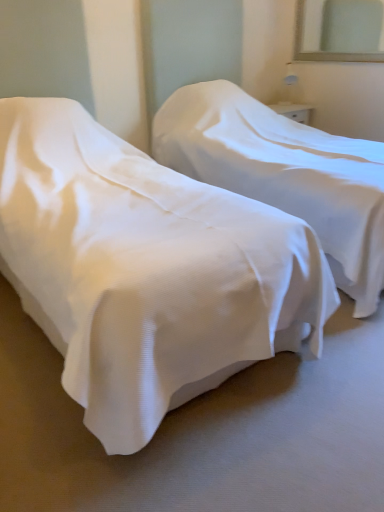
The height and width of the screenshot is (512, 384). In order to click on clear glass mirror at upper right in this screenshot , I will do `click(339, 30)`.

The image size is (384, 512). Describe the element at coordinates (284, 174) in the screenshot. I see `white fabric bed at center, marked as the 1th bed in a right-to-left arrangement` at that location.

Find the location of a particular element. This screenshot has height=512, width=384. clear glass mirror at upper right is located at coordinates (339, 30).

Is point (333, 47) in front of point (359, 231)?

No, it is behind (359, 231).

How far apart are clear glass mirror at upper right and white fabric bed at center, acting as the 2th bed starting from the left?

The distance of clear glass mirror at upper right from white fabric bed at center, acting as the 2th bed starting from the left, is 6.79 feet.

Considering the sizes of objects clear glass mirror at upper right and white fabric bed at center, acting as the 2th bed starting from the left, in the image provided, who is wider, clear glass mirror at upper right or white fabric bed at center, acting as the 2th bed starting from the left,?

white fabric bed at center, acting as the 2th bed starting from the left.

Who is taller, clear glass mirror at upper right or white fabric bed at center, marked as the 1th bed in a right-to-left arrangement?

white fabric bed at center, marked as the 1th bed in a right-to-left arrangement, is taller.

Which of these two, clear glass mirror at upper right or white fabric bed at center, which is the first bed in left-to-right order, is thinner?

Thinner between the two is clear glass mirror at upper right.

Is point (364, 59) closer or farther from the camera than point (128, 164)?

Clearly, point (364, 59) is more distant from the camera than point (128, 164).

Is clear glass mirror at upper right positioned beyond the bounds of white fabric bed at center, the second bed viewed from the right?

clear glass mirror at upper right is positioned outside white fabric bed at center, the second bed viewed from the right.

Considering the relative sizes of clear glass mirror at upper right and white fabric bed at center, the second bed viewed from the right, in the image provided, is clear glass mirror at upper right shorter than white fabric bed at center, the second bed viewed from the right,?

Indeed, clear glass mirror at upper right has a lesser height compared to white fabric bed at center, the second bed viewed from the right.

From the image's perspective, between white fabric bed at center, the second bed viewed from the right, and clear glass mirror at upper right, which one is located above?

clear glass mirror at upper right appears higher in the image.

Are white fabric bed at center, the second bed viewed from the right, and clear glass mirror at upper right far apart?

Yes, white fabric bed at center, the second bed viewed from the right, is far from clear glass mirror at upper right.

How far apart are white fabric bed at center, which is the first bed in left-to-right order, and clear glass mirror at upper right?

The distance of white fabric bed at center, which is the first bed in left-to-right order, from clear glass mirror at upper right is 10.93 feet.

From a real-world perspective, between white fabric bed at center, the second bed viewed from the right, and clear glass mirror at upper right, who is vertically higher?

From a 3D spatial view, clear glass mirror at upper right is above.

Can clear glass mirror at upper right be found inside white fabric bed at center, acting as the 2th bed starting from the left?

No.

At what (x,y) coordinates should I click in order to perform the action: click on the 1st bed below when counting from the clear glass mirror at upper right (from the image's perspective). Please return your answer as a coordinate pair (x, y). The image size is (384, 512). Looking at the image, I should click on (284, 174).

Is white fabric bed at center, acting as the 2th bed starting from the left, turned away from clear glass mirror at upper right?

white fabric bed at center, acting as the 2th bed starting from the left, does not have its back to clear glass mirror at upper right.

From a real-world perspective, is white fabric bed at center, acting as the 2th bed starting from the left, physically below clear glass mirror at upper right?

Yes, from a real-world perspective, white fabric bed at center, acting as the 2th bed starting from the left, is below clear glass mirror at upper right.

Can you confirm if white fabric bed at center, the second bed viewed from the right, is positioned to the right of white fabric bed at center, acting as the 2th bed starting from the left?

No, white fabric bed at center, the second bed viewed from the right, is not to the right of white fabric bed at center, acting as the 2th bed starting from the left.

Can you tell me how much white fabric bed at center, which is the first bed in left-to-right order, and white fabric bed at center, marked as the 1th bed in a right-to-left arrangement, differ in facing direction?

There is a 0.000127-degree angle between the facing directions of white fabric bed at center, which is the first bed in left-to-right order, and white fabric bed at center, marked as the 1th bed in a right-to-left arrangement.

Is white fabric bed at center, the second bed viewed from the right, in front of or behind white fabric bed at center, marked as the 1th bed in a right-to-left arrangement, in the image?

Clearly, white fabric bed at center, the second bed viewed from the right, is in front of white fabric bed at center, marked as the 1th bed in a right-to-left arrangement.

From the image's perspective, would you say white fabric bed at center, the second bed viewed from the right, is positioned over white fabric bed at center, marked as the 1th bed in a right-to-left arrangement?

No, from the image's perspective, white fabric bed at center, the second bed viewed from the right, is not above white fabric bed at center, marked as the 1th bed in a right-to-left arrangement.

Based on the photo, which object is further away from the camera, white fabric bed at center, acting as the 2th bed starting from the left, or white fabric bed at center, which is the first bed in left-to-right order?

white fabric bed at center, acting as the 2th bed starting from the left, is more distant.

Is white fabric bed at center, marked as the 1th bed in a right-to-left arrangement, taller or shorter than white fabric bed at center, the second bed viewed from the right?

white fabric bed at center, marked as the 1th bed in a right-to-left arrangement, is taller than white fabric bed at center, the second bed viewed from the right.

From the image's perspective, who appears lower, white fabric bed at center, acting as the 2th bed starting from the left, or white fabric bed at center, the second bed viewed from the right?

white fabric bed at center, the second bed viewed from the right, is shown below in the image.

In the image, there is a white fabric bed at center, acting as the 2th bed starting from the left. Identify the location of mirror above it (from the image's perspective). (339, 30).

From the image's perspective, which bed is the 2nd one below the clear glass mirror at upper right? Please provide its 2D coordinates.

[(146, 270)]

Considering their positions, is clear glass mirror at upper right positioned closer to white fabric bed at center, which is the first bed in left-to-right order, than white fabric bed at center, acting as the 2th bed starting from the left?

white fabric bed at center, acting as the 2th bed starting from the left, lies closer to white fabric bed at center, which is the first bed in left-to-right order, than the other object.

From the image, which object appears to be farther from clear glass mirror at upper right, white fabric bed at center, the second bed viewed from the right, or white fabric bed at center, acting as the 2th bed starting from the left?

white fabric bed at center, the second bed viewed from the right, lies further to clear glass mirror at upper right than the other object.

Which object lies further to the anchor point white fabric bed at center, marked as the 1th bed in a right-to-left arrangement, clear glass mirror at upper right or white fabric bed at center, which is the first bed in left-to-right order?

Among the two, clear glass mirror at upper right is located further to white fabric bed at center, marked as the 1th bed in a right-to-left arrangement.

When comparing their distances from white fabric bed at center, marked as the 1th bed in a right-to-left arrangement, does white fabric bed at center, the second bed viewed from the right, or clear glass mirror at upper right seem closer?

Based on the image, white fabric bed at center, the second bed viewed from the right, appears to be nearer to white fabric bed at center, marked as the 1th bed in a right-to-left arrangement.

From the image, which object appears to be nearer to white fabric bed at center, which is the first bed in left-to-right order, white fabric bed at center, marked as the 1th bed in a right-to-left arrangement, or clear glass mirror at upper right?

white fabric bed at center, marked as the 1th bed in a right-to-left arrangement, lies closer to white fabric bed at center, which is the first bed in left-to-right order, than the other object.

Considering their positions, is white fabric bed at center, acting as the 2th bed starting from the left, positioned closer to clear glass mirror at upper right than white fabric bed at center, the second bed viewed from the right?

white fabric bed at center, acting as the 2th bed starting from the left, lies closer to clear glass mirror at upper right than the other object.

The image size is (384, 512). I want to click on bed between white fabric bed at center, which is the first bed in left-to-right order, and clear glass mirror at upper right in the front-back direction, so click(284, 174).